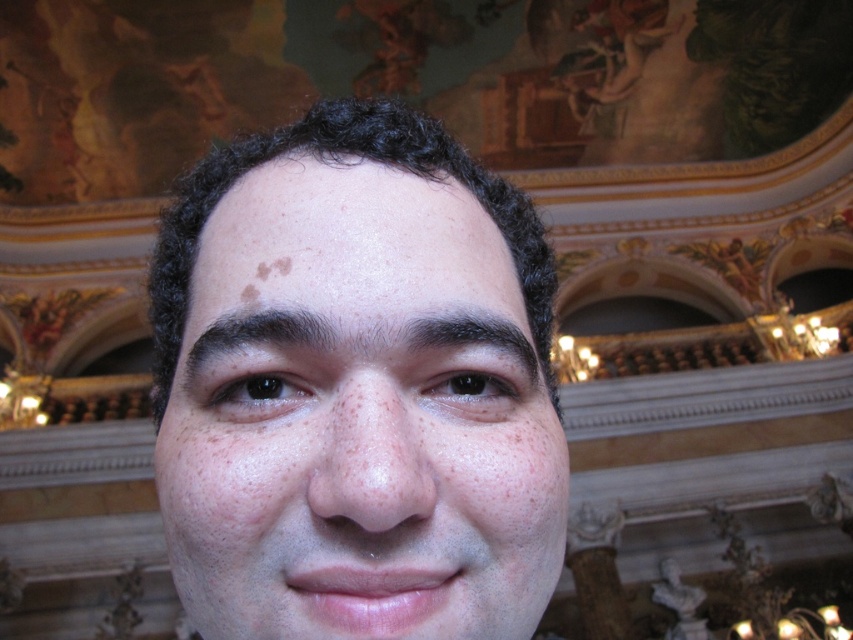
The height and width of the screenshot is (640, 853). Describe the element at coordinates (257, 333) in the screenshot. I see `brown matte eyebrow at upper left` at that location.

Is point (248, 308) positioned before point (466, 332)?

No, it is behind (466, 332).

Is point (189, 365) farther from viewer compared to point (454, 333)?

Yes, point (189, 365) is farther from viewer.

Locate an element on the screen. The width and height of the screenshot is (853, 640). brown matte eyebrow at upper left is located at coordinates (257, 333).

Can you confirm if smooth skin face at center is positioned to the right of dark brown hair at center?

No, smooth skin face at center is not to the right of dark brown hair at center.

Is smooth skin face at center thinner than dark brown hair at center?

Incorrect, smooth skin face at center's width is not less than dark brown hair at center's.

Is point (335, 282) farther from viewer compared to point (456, 342)?

That is False.

Locate an element on the screen. The height and width of the screenshot is (640, 853). smooth skin face at center is located at coordinates click(352, 388).

Which is above, smooth skin face at center or brown matte eyebrow at upper left?

smooth skin face at center

Can you confirm if smooth skin face at center is thinner than brown matte eyebrow at upper left?

No.

Who is more distant from viewer, (233, 225) or (320, 326)?

Positioned behind is point (233, 225).

Locate an element on the screen. smooth skin face at center is located at coordinates (352, 388).